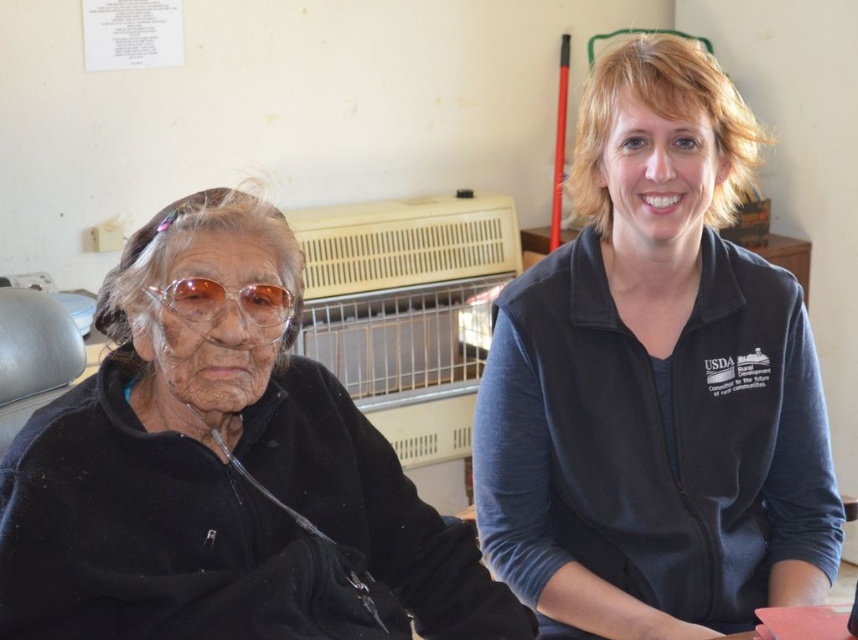
Is point (347, 481) positioned before point (240, 296)?

No, it is behind (240, 296).

How far apart are black fleece at left and translucent plastic goggles at upper left?

black fleece at left is 8.23 inches from translucent plastic goggles at upper left.

What do you see at coordinates (222, 476) in the screenshot? I see `black fleece at left` at bounding box center [222, 476].

The height and width of the screenshot is (640, 858). What are the coordinates of `black fleece at left` in the screenshot? It's located at (222, 476).

Between blue fleece jacket at right and black fleece at left, which one appears on the right side from the viewer's perspective?

Positioned to the right is blue fleece jacket at right.

Does point (511, 488) lie in front of point (208, 520)?

No, (511, 488) is further to viewer.

You are a GUI agent. You are given a task and a screenshot of the screen. Output one action in this format:
    pyautogui.click(x=<x>, y=<y>)
    Task: Click on the blue fleece jacket at right
    The width and height of the screenshot is (858, 640).
    Given the screenshot: What is the action you would take?
    pyautogui.click(x=656, y=384)

Is blue fleece jacket at right thinner than translucent plastic goggles at upper left?

No.

Who is more distant from viewer, (630, 42) or (245, 298)?

The point (630, 42) is more distant.

Does point (588, 381) come in front of point (249, 317)?

That is False.

Identify the location of blue fleece jacket at right. (656, 384).